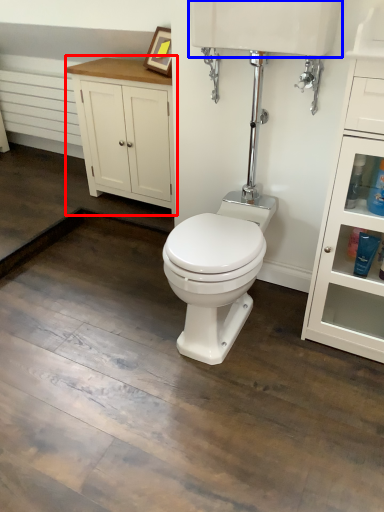
Question: Which point is further to the camera, bathroom cabinet (highlighted by a red box) or sink (highlighted by a blue box)?

Choices:
 (A) bathroom cabinet
 (B) sink

Answer: (A)